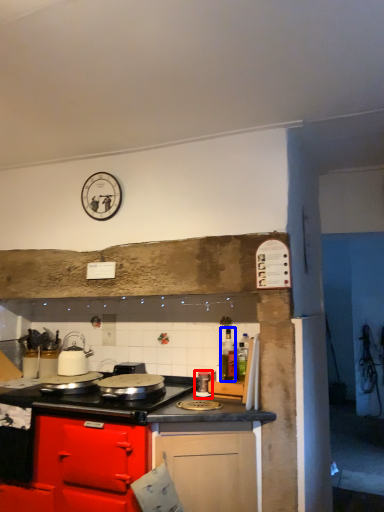
Question: Which point is further to the camera, kitchen appliance (highlighted by a red box) or bottle (highlighted by a blue box)?

Choices:
 (A) kitchen appliance
 (B) bottle

Answer: (B)